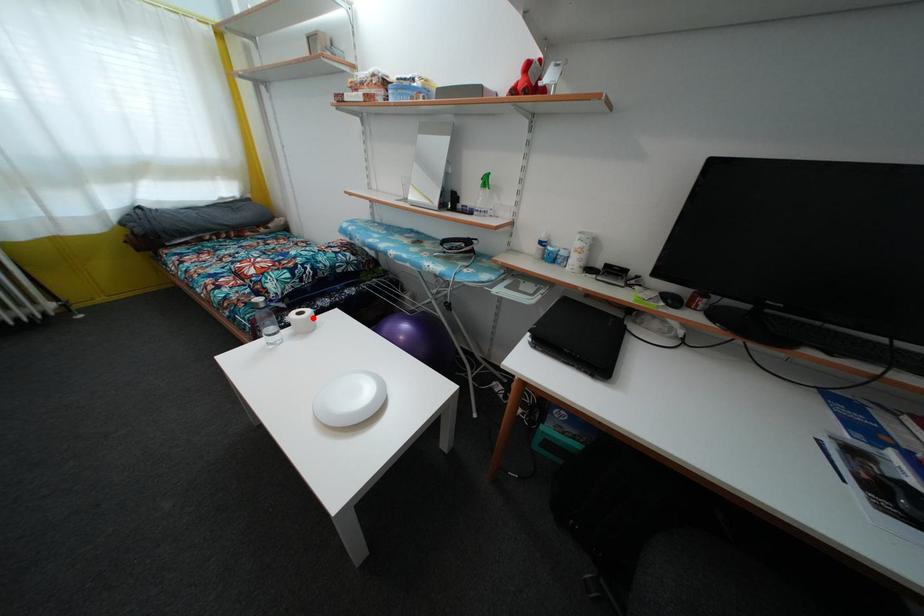
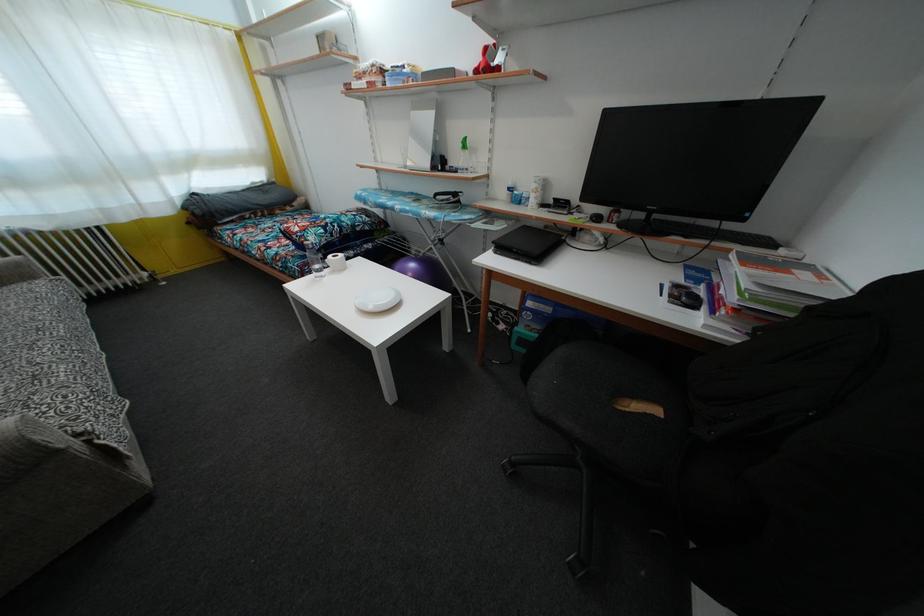
Where in the second image is the point corresponding to the highlighted location from the first image?

(345, 262)